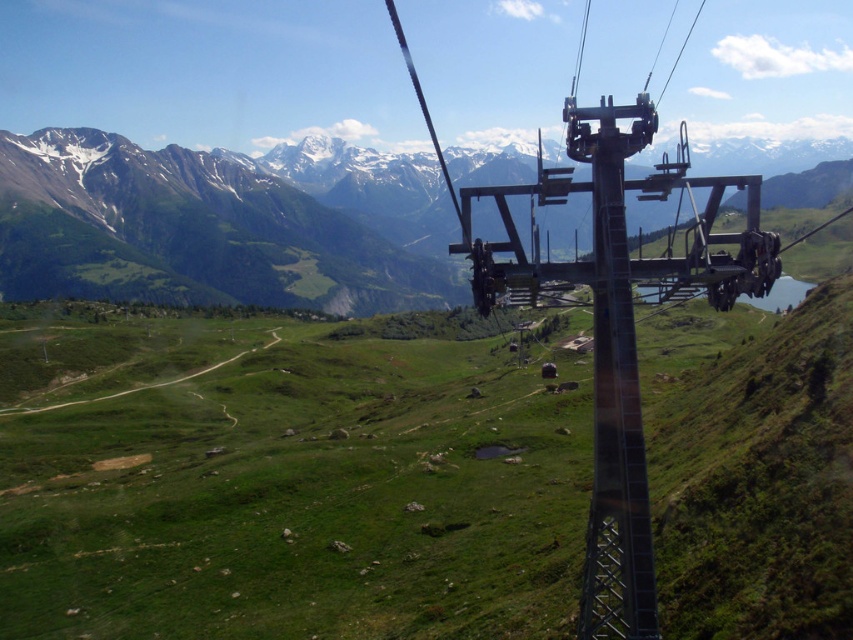
You are standing inside the cable car and want to know how far the snowy granite mountain range at upper center is from you. Can you determine the distance?

The snowy granite mountain range at upper center is 374.27 meters away from the viewer.

You are a maintenance worker checking the structural integrity of the metallic gray ski lift at center and the metallic gray pole at center from the cable car. Which object requires a wider inspection area due to its size?

The metallic gray ski lift at center requires a wider inspection area because it is wider than the metallic gray pole at center according to the description.